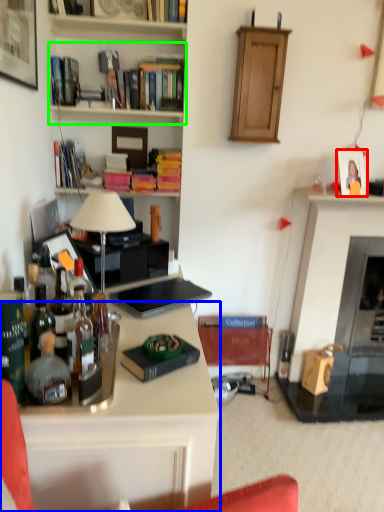
Question: Which object is the closest to the picture frame (highlighted by a red box)? Choose among these: desk (highlighted by a blue box) or shelf (highlighted by a green box).

Choices:
 (A) desk
 (B) shelf

Answer: (B)